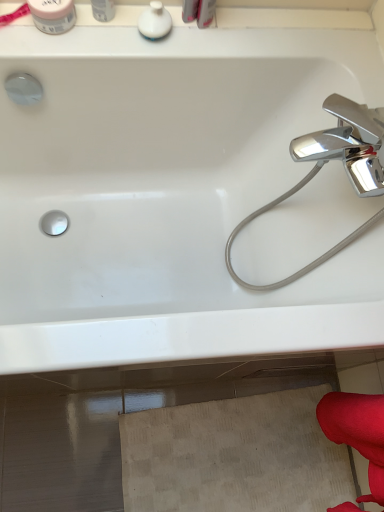
Question: From a real-world perspective, does white glossy soap dispenser at upper center, which ranks as the first toiletry in right-to-left order, stand above white glossy bathtub at upper center?

Choices:
 (A) yes
 (B) no

Answer: (A)

Question: From the image's perspective, is white glossy soap dispenser at upper center, which ranks as the first toiletry in right-to-left order, located above white glossy bathtub at upper center?

Choices:
 (A) no
 (B) yes

Answer: (B)

Question: Is white glossy soap dispenser at upper center, the third toiletry in the left-to-right sequence, beside white glossy bathtub at upper center?

Choices:
 (A) yes
 (B) no

Answer: (B)

Question: Could you tell me if white glossy soap dispenser at upper center, which ranks as the first toiletry in right-to-left order, is turned towards white glossy bathtub at upper center?

Choices:
 (A) yes
 (B) no

Answer: (B)

Question: Considering the relative positions of white glossy soap dispenser at upper center, the third toiletry in the left-to-right sequence, and white glossy bathtub at upper center in the image provided, is white glossy soap dispenser at upper center, the third toiletry in the left-to-right sequence, to the left of white glossy bathtub at upper center from the viewer's perspective?

Choices:
 (A) no
 (B) yes

Answer: (B)

Question: Based on their sizes in the image, would you say white glossy bathtub at upper center is bigger or smaller than white glossy soap dispenser at upper center, the third toiletry in the left-to-right sequence?

Choices:
 (A) small
 (B) big

Answer: (B)

Question: Is white glossy bathtub at upper center inside the boundaries of white glossy soap dispenser at upper center, the third toiletry in the left-to-right sequence, or outside?

Choices:
 (A) outside
 (B) inside

Answer: (A)

Question: From their relative heights in the image, would you say white glossy bathtub at upper center is taller or shorter than white glossy soap dispenser at upper center, the third toiletry in the left-to-right sequence?

Choices:
 (A) short
 (B) tall

Answer: (B)

Question: From the image's perspective, relative to white glossy soap dispenser at upper center, the third toiletry in the left-to-right sequence, is white glossy bathtub at upper center above or below?

Choices:
 (A) above
 (B) below

Answer: (B)

Question: In terms of height, does white glossy container at upper left, placed as the 2th toiletry when sorted from left to right, look taller or shorter compared to white matte jar at upper left, the 1th toiletry positioned from the left?

Choices:
 (A) short
 (B) tall

Answer: (B)

Question: Is white glossy container at upper left, placed as the 2th toiletry when sorted from left to right, inside or outside of white matte jar at upper left, the 3th toiletry viewed from the right?

Choices:
 (A) outside
 (B) inside

Answer: (A)

Question: From a real-world perspective, is white glossy container at upper left, placed as the 2th toiletry when sorted from left to right, physically located above or below white matte jar at upper left, the 3th toiletry viewed from the right?

Choices:
 (A) below
 (B) above

Answer: (B)

Question: In terms of width, does white glossy container at upper left, acting as the 2th toiletry starting from the right, look wider or thinner when compared to white matte jar at upper left, the 3th toiletry viewed from the right?

Choices:
 (A) wide
 (B) thin

Answer: (B)

Question: Is point (334, 120) closer or farther from the camera than point (51, 19)?

Choices:
 (A) farther
 (B) closer

Answer: (A)

Question: Which is correct: white glossy bathtub at upper center is inside white matte jar at upper left, the 3th toiletry viewed from the right, or outside of it?

Choices:
 (A) inside
 (B) outside

Answer: (B)